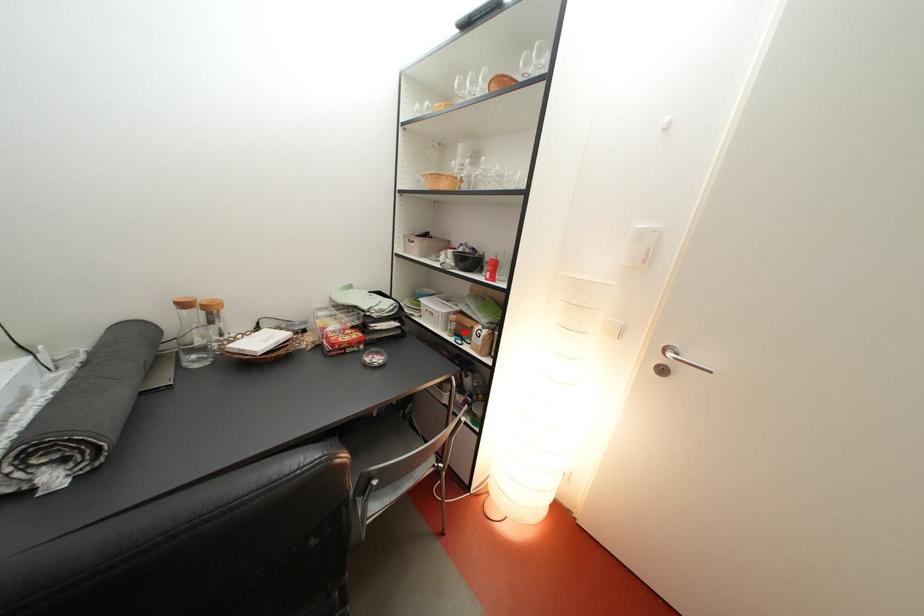
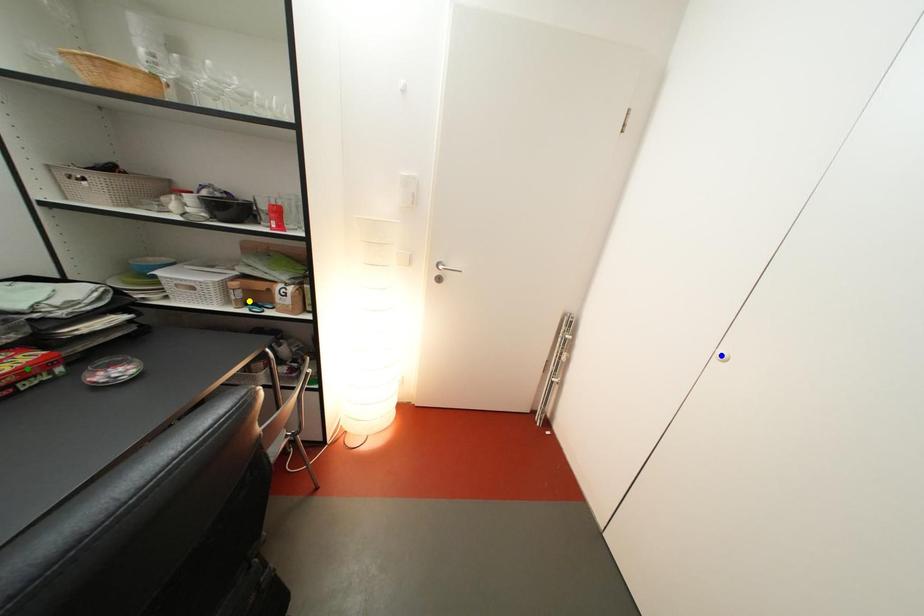
Question: I am providing you with two images of the same scene from different viewpoints. A red point is marked on the first image. You are given multiple points on the second image. Which point in image 2 represents the same 3d spot as the red point in image 1?

Choices:
 (A) blue point
 (B) green point
 (C) yellow point

Answer: (C)